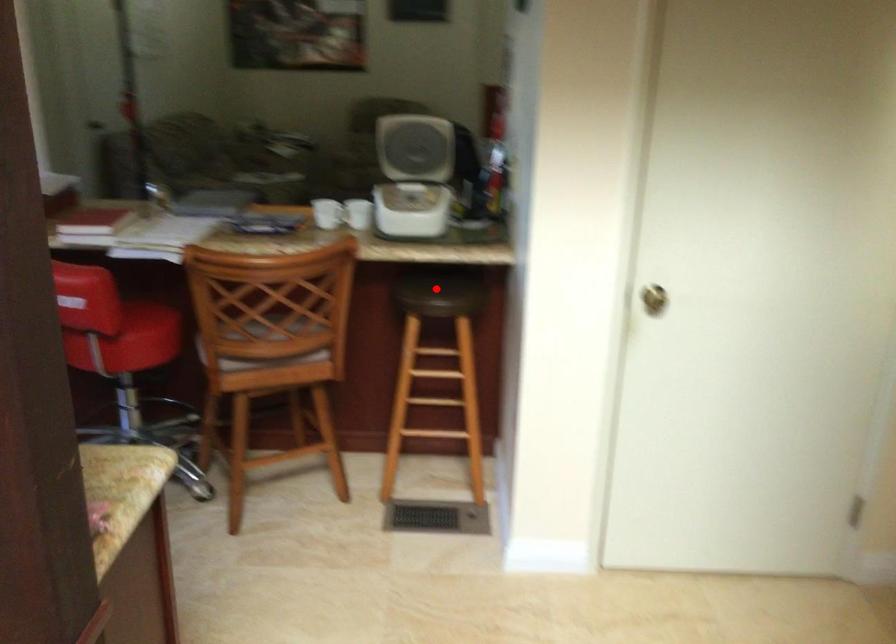
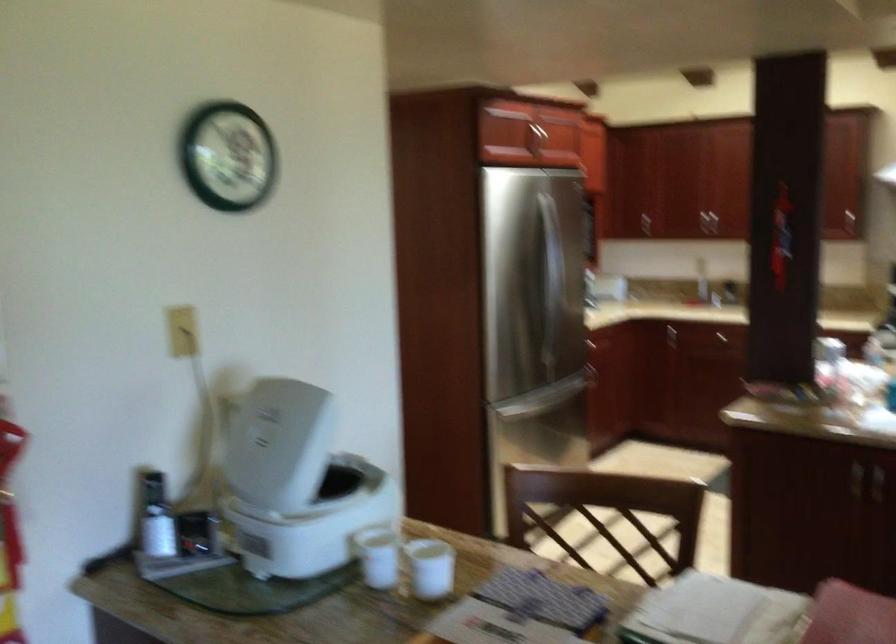
Question: I am providing you with two images of the same scene from different viewpoints. A red point is marked on the first image. Is the red point's position out of view in image 2?

Choices:
 (A) Yes
 (B) No

Answer: (A)